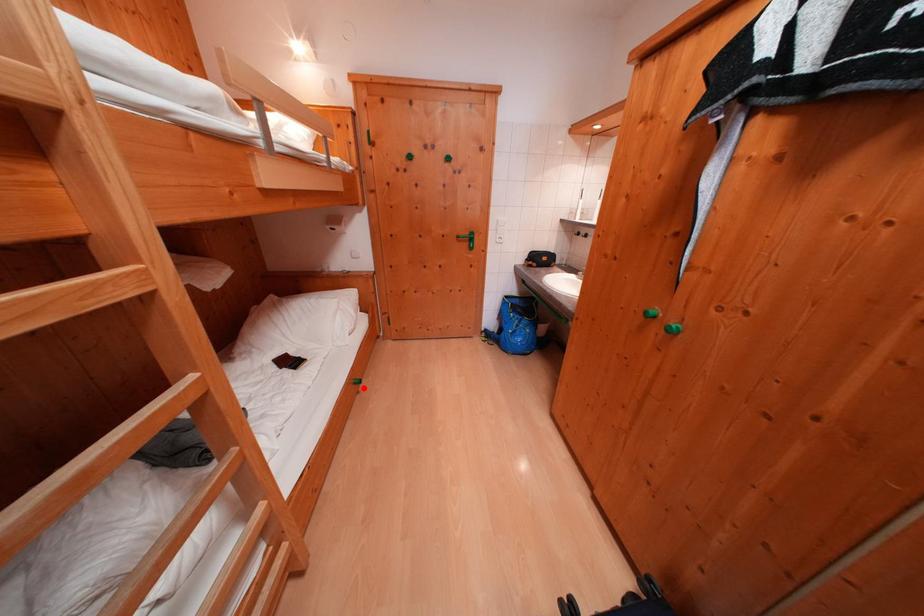
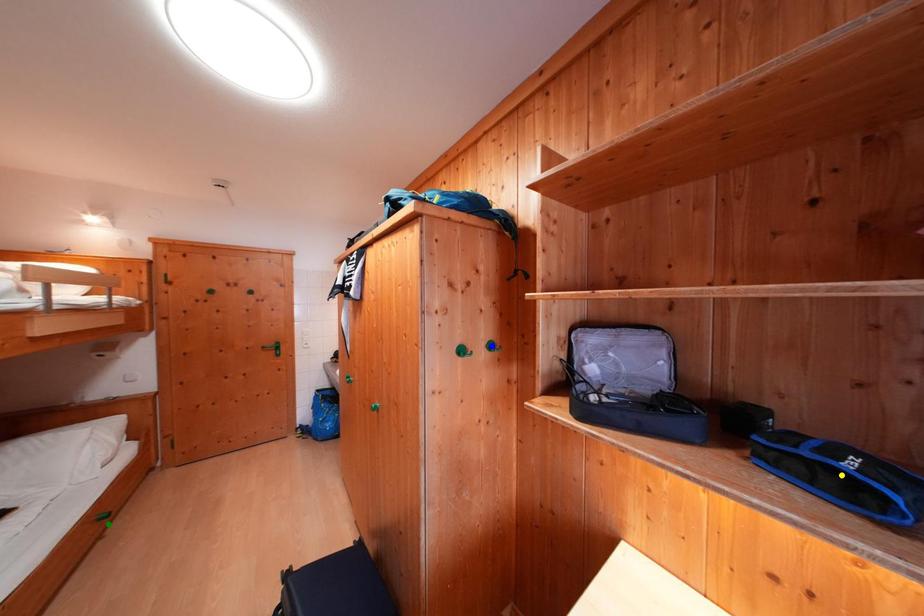
Question: I am providing you with two images of the same scene from different viewpoints. A red point is marked on the first image. You are given multiple points on the second image. In image 2, which mark is for the same physical point as the one in image 1?

Choices:
 (A) yellow point
 (B) green point
 (C) blue point

Answer: (B)